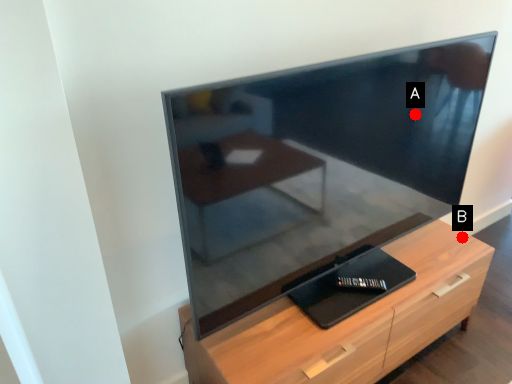
Question: Two points are circled on the image, labeled by A and B beside each circle. Which point appears closest to the camera in this image?

Choices:
 (A) A is closer
 (B) B is closer

Answer: (A)